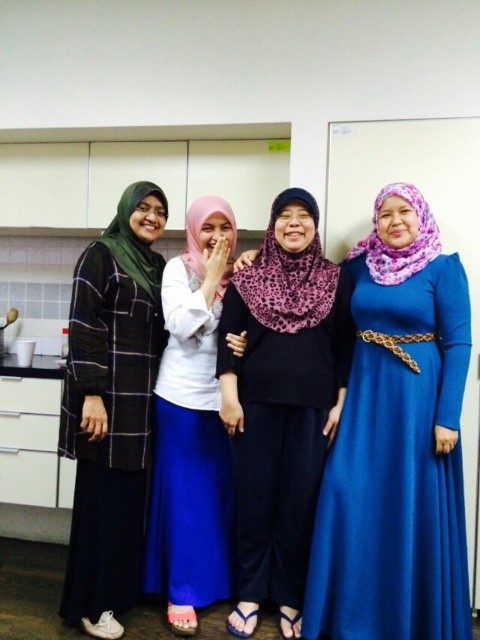
Question: Observing the image, what is the correct spatial positioning of purple leopard print hijab at center in reference to white matte hijab at center?

Choices:
 (A) above
 (B) below

Answer: (B)

Question: Among these objects, which one is farthest from the camera?

Choices:
 (A) matte black hijab at left
 (B) purple leopard print hijab at center
 (C) white matte hijab at center

Answer: (C)

Question: In this image, where is blue satin dress at right located relative to matte black hijab at left?

Choices:
 (A) right
 (B) left

Answer: (A)

Question: Estimate the real-world distances between objects in this image. Which object is closer to the purple leopard print hijab at center?

Choices:
 (A) white matte hijab at center
 (B) matte black hijab at left
 (C) blue satin dress at right

Answer: (A)

Question: Can you confirm if purple leopard print hijab at center is positioned above matte black hijab at left?

Choices:
 (A) yes
 (B) no

Answer: (B)

Question: Which point is farther to the camera?

Choices:
 (A) (292, 477)
 (B) (383, 506)
 (C) (91, 417)
 (D) (190, 291)

Answer: (D)